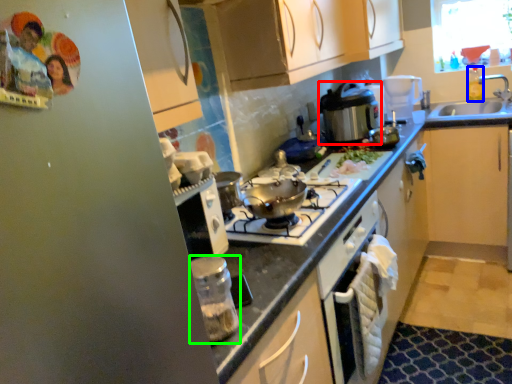
Question: Which object is the farthest from kitchen appliance (highlighted by a red box)? Choose among these: bottle (highlighted by a blue box) or kitchen appliance (highlighted by a green box).

Choices:
 (A) bottle
 (B) kitchen appliance

Answer: (B)